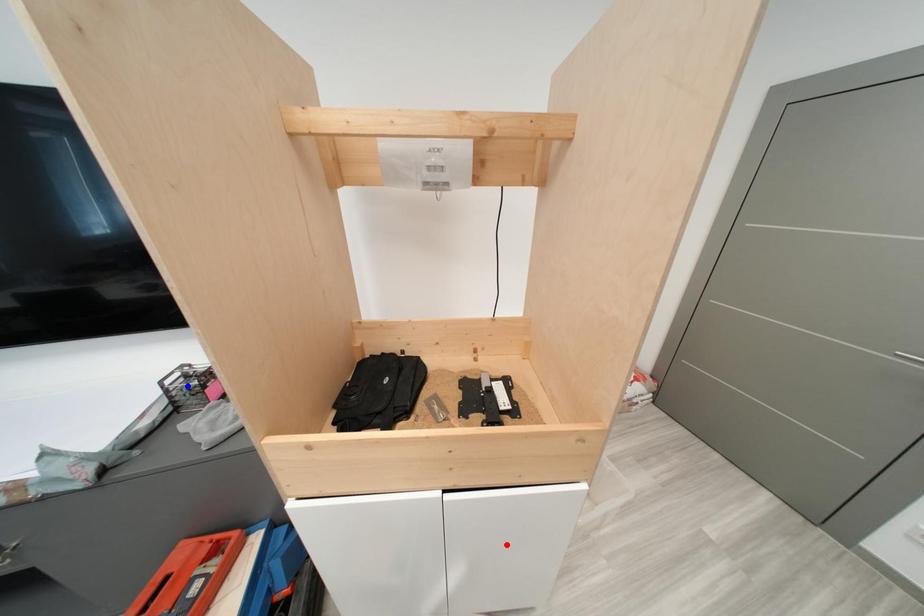
Question: Which of the two points in the image is closer to the camera?

Choices:
 (A) Blue point is closer.
 (B) Red point is closer.

Answer: (B)